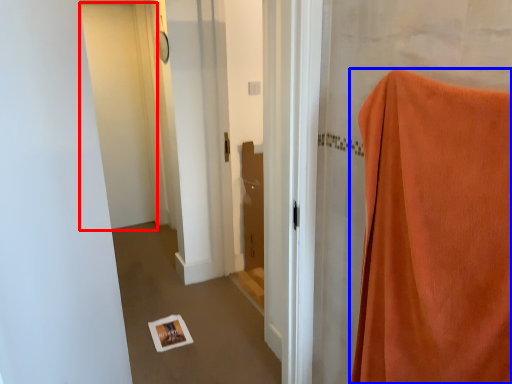
Question: Among these objects, which one is farthest to the camera, door (highlighted by a red box) or curtain (highlighted by a blue box)?

Choices:
 (A) door
 (B) curtain

Answer: (A)